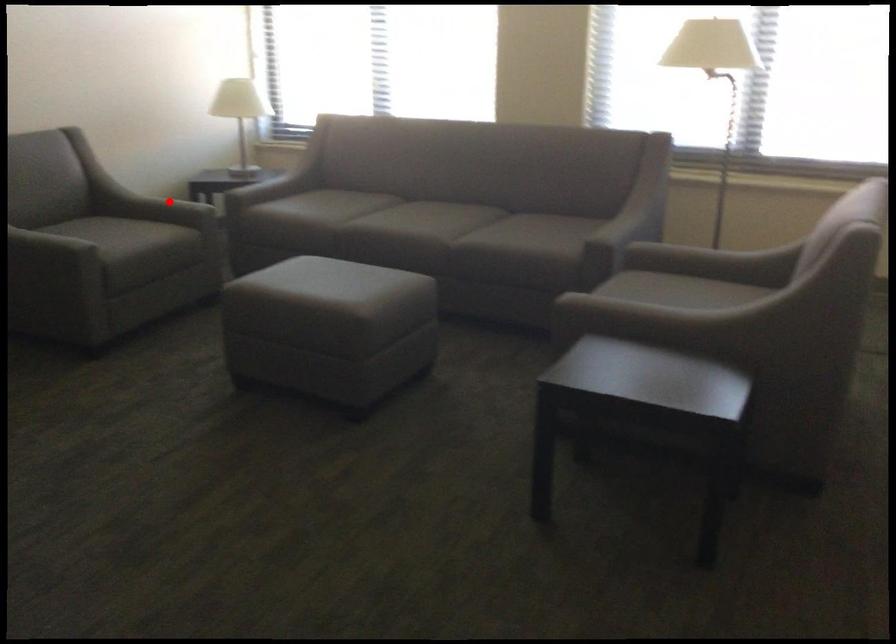
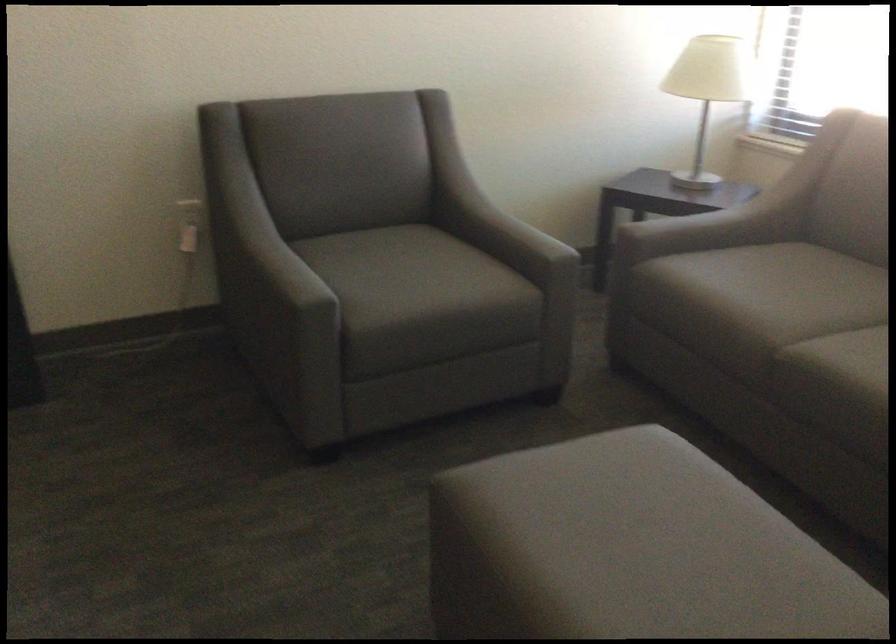
Where in the second image is the point corresponding to the highlighted location from the first image?

(509, 234)